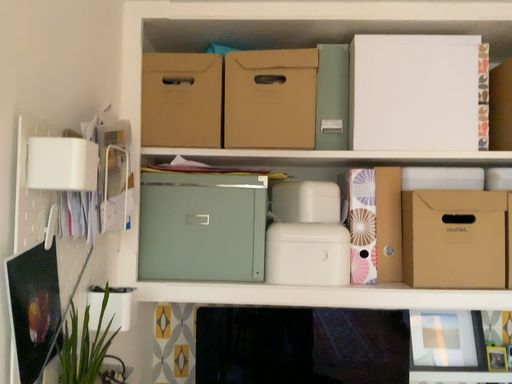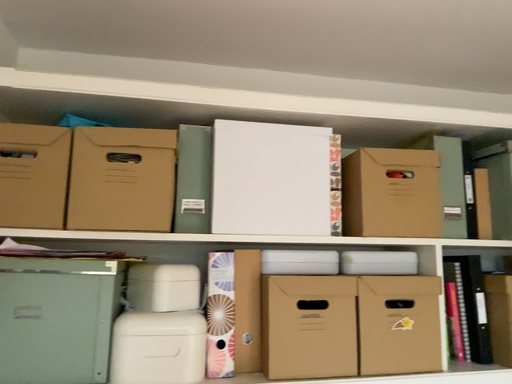
Question: How did the camera likely rotate when shooting the video?

Choices:
 (A) rotated left
 (B) rotated right

Answer: (B)